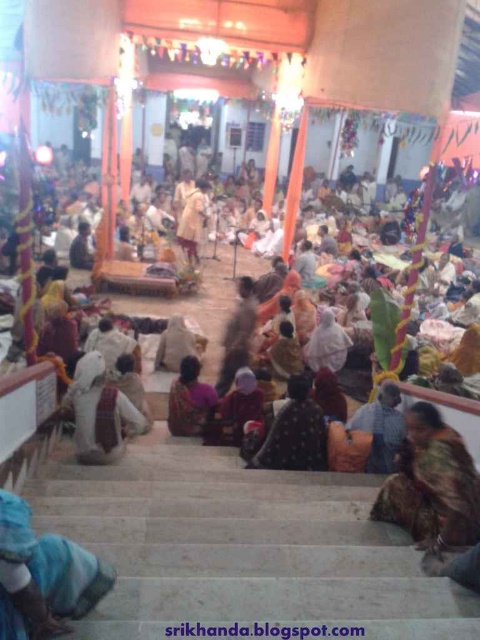
Question: Which is farther from the dark brown fabric at center?

Choices:
 (A) blue fabric at lower left
 (B) orange fabric sari at center
 (C) multicolored fabric at lower right

Answer: (A)

Question: Which object is the farthest from the blue fabric at lower left?

Choices:
 (A) dark brown fabric at center
 (B) orange fabric sari at center

Answer: (B)

Question: Can you confirm if white clothed person at center is thinner than orange fabric sari at center?

Choices:
 (A) no
 (B) yes

Answer: (A)

Question: Observing the image, what is the correct spatial positioning of multicolored fabric at lower right in reference to orange fabric sari at center?

Choices:
 (A) below
 (B) above

Answer: (A)

Question: Can you confirm if white clothed person at center is bigger than dark brown fabric at center?

Choices:
 (A) yes
 (B) no

Answer: (A)

Question: Which point is farther from the camera taking this photo?

Choices:
 (A) (203, 417)
 (B) (289, 458)
 (C) (429, 419)
 (D) (100, 406)

Answer: (A)